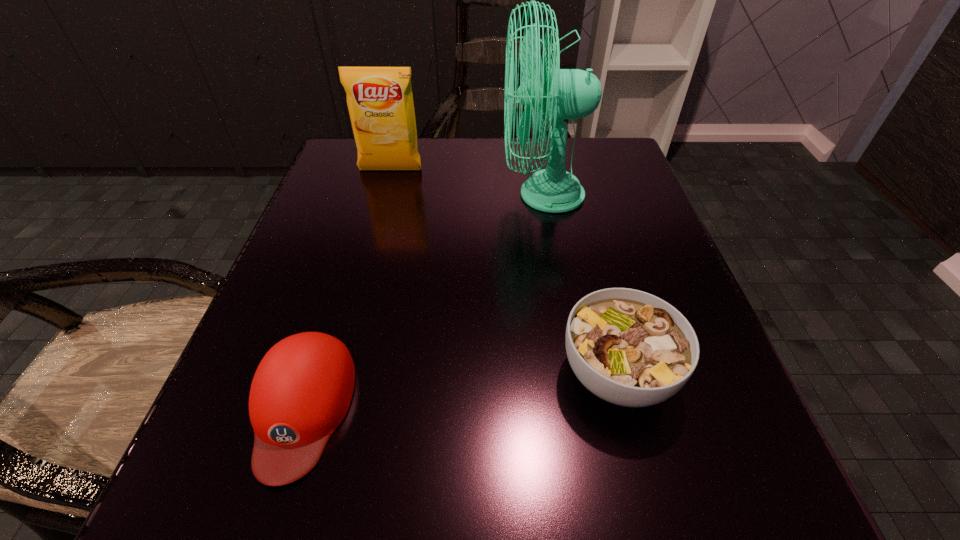
Image resolution: width=960 pixels, height=540 pixels. In order to click on empty space between the soup bowl and the third shortest object in this screenshot , I will do `click(504, 272)`.

The height and width of the screenshot is (540, 960). I want to click on empty space that is in between the baseball cap and the second tallest object, so click(347, 289).

Find the location of a particular element. vacant space that is in between the baseball cap and the soup bowl is located at coordinates (460, 391).

Where is `free space between the fan and the second tallest object`? free space between the fan and the second tallest object is located at coordinates (467, 183).

This screenshot has height=540, width=960. What are the coordinates of `free spot between the baseball cap and the fan` in the screenshot? It's located at (422, 301).

Image resolution: width=960 pixels, height=540 pixels. What are the coordinates of `free space that is in between the baseball cap and the fan` in the screenshot? It's located at (422, 301).

Choose which object is the second nearest neighbor to the baseball cap. Please provide its 2D coordinates. Your answer should be formatted as a tuple, i.e. [(x, y)], where the tuple contains the x and y coordinates of a point satisfying the conditions above.

[(570, 93)]

Choose which object is the third nearest neighbor to the tallest object. Please provide its 2D coordinates. Your answer should be formatted as a tuple, i.e. [(x, y)], where the tuple contains the x and y coordinates of a point satisfying the conditions above.

[(301, 391)]

Locate an element on the screen. vacant space that satisfies the following two spatial constraints: 1. on the back side of the soup bowl; 2. in front of the tallest object to blow air is located at coordinates (571, 195).

This screenshot has width=960, height=540. In order to click on free space in the image that satisfies the following two spatial constraints: 1. on the front of the soup bowl with the logo; 2. on the left side of the second tallest object in this screenshot , I will do `click(337, 374)`.